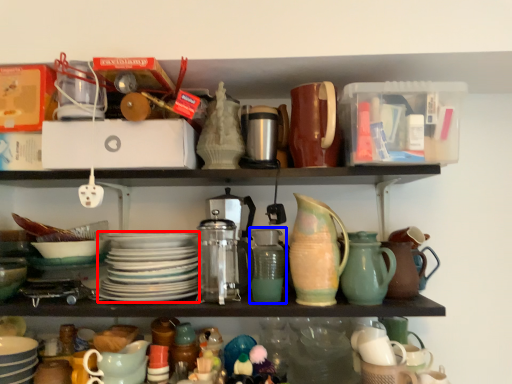
Question: Which of the following is the closest to the observer, platter (highlighted by a red box) or pottery (highlighted by a blue box)?

Choices:
 (A) platter
 (B) pottery

Answer: (A)